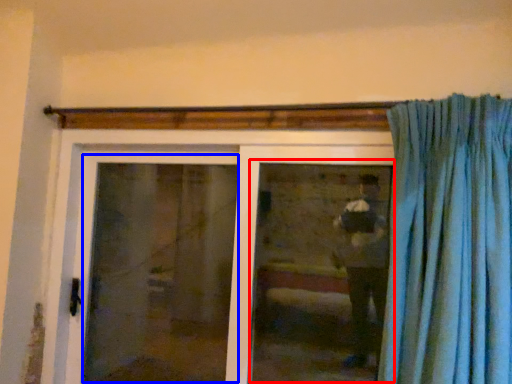
Question: Which of the following is the closest to the observer, window (highlighted by a red box) or screen door (highlighted by a blue box)?

Choices:
 (A) window
 (B) screen door

Answer: (A)